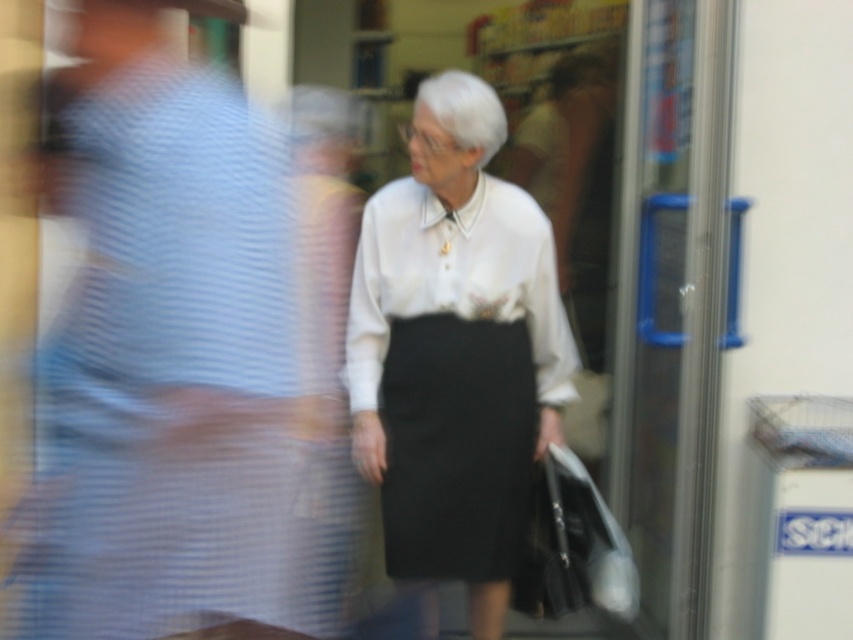
You are a photographer trying to capture the elderly woman in focus. You notice the black matte skirt at center and the white matte shopping bag at lower right in your viewfinder. Which object should you adjust your focus to ensure the elderly woman is sharp?

The black matte skirt at center is much taller than the white matte shopping bag at lower right, so focusing on the black matte skirt at center will ensure the elderly woman is in focus since it is closer to the camera.

You are trying to locate the white matte blouse at center in the image. According to the coordinates provided, where exactly is it positioned?

The white matte blouse at center is located at point 0.553 on the x axis and 0.533 on the y axis.